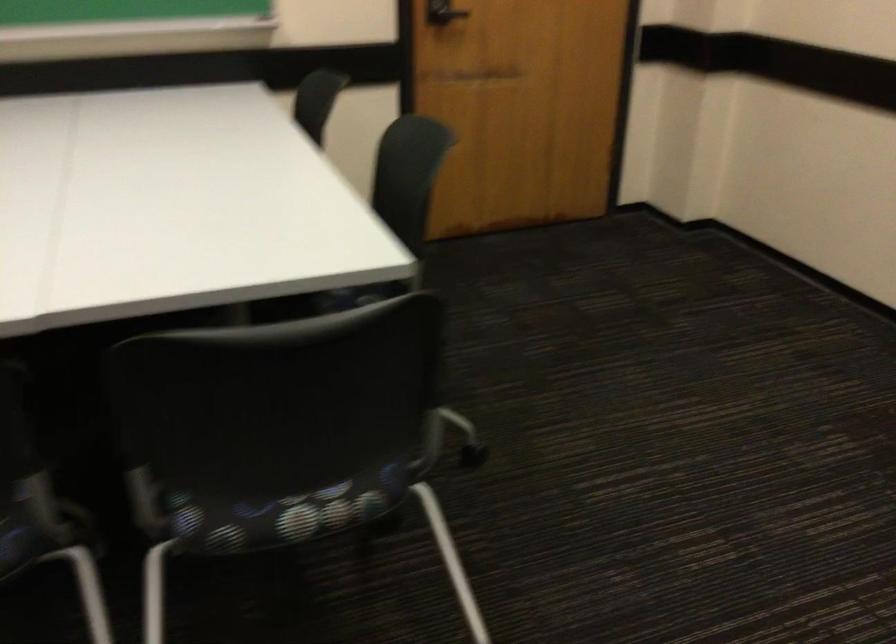
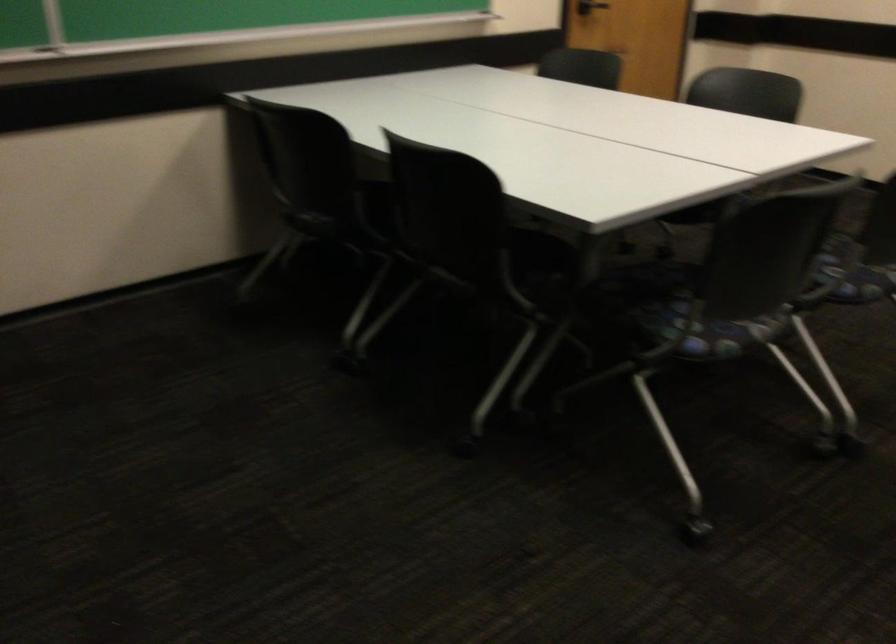
The point at (138, 500) is marked in the first image. Where is the corresponding point in the second image?

(853, 272)